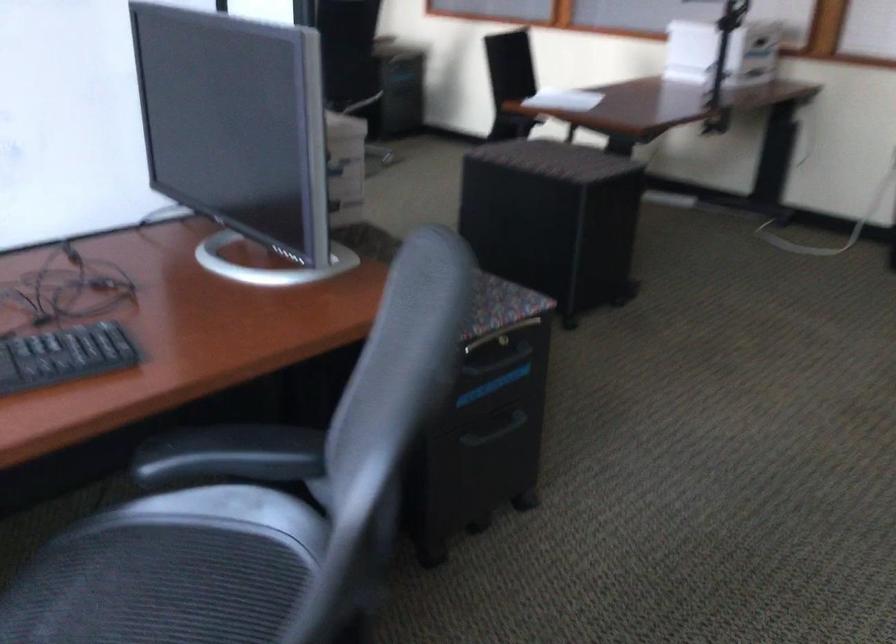
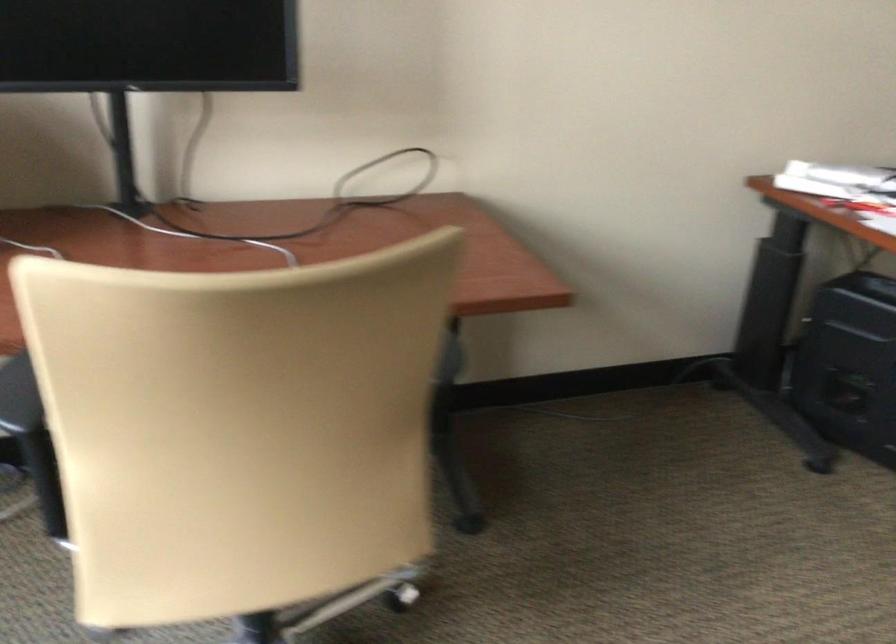
In a continuous first-person perspective shot, in which direction is the camera moving?

The movement direction of the cameraman is left, forward.